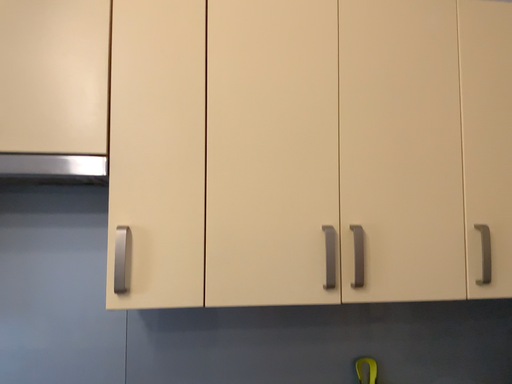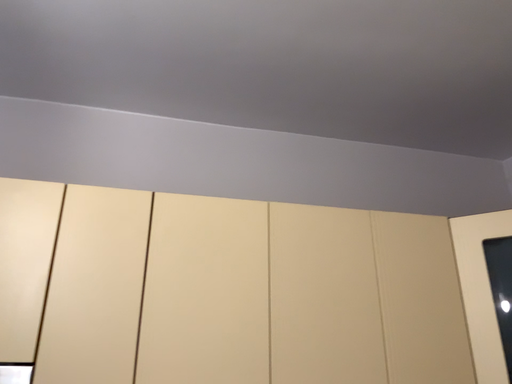
Question: Which way did the camera rotate in the video?

Choices:
 (A) rotated upward
 (B) rotated downward

Answer: (A)